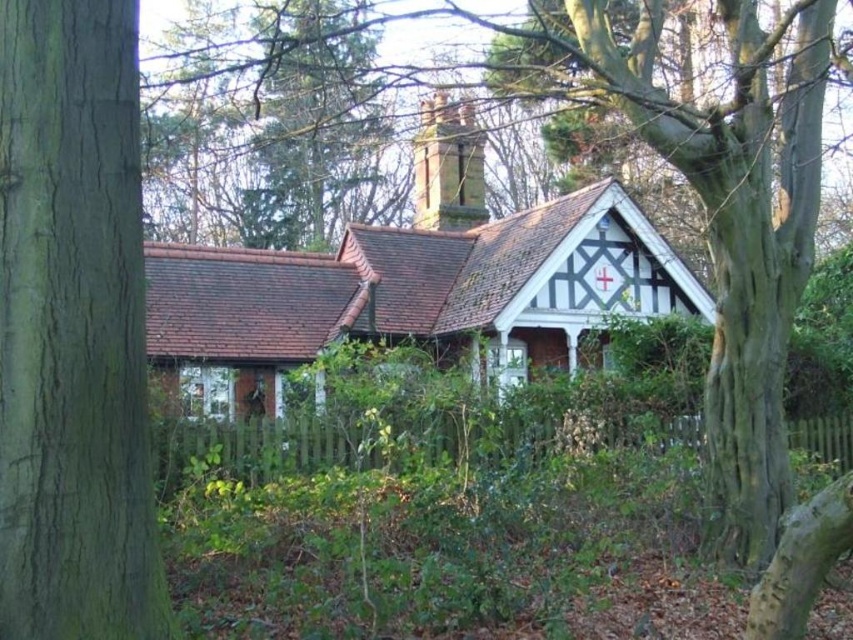
Question: Is green rough bark tree at left thinner than white painted wood cottage at center?

Choices:
 (A) yes
 (B) no

Answer: (A)

Question: Which point is farther to the camera?

Choices:
 (A) (389, 269)
 (B) (125, 340)

Answer: (A)

Question: Which point is farther to the camera?

Choices:
 (A) white painted wood cottage at center
 (B) green rough bark tree at left

Answer: (A)

Question: Does green rough bark tree at left appear under white painted wood cottage at center?

Choices:
 (A) no
 (B) yes

Answer: (B)

Question: Can you confirm if green rough bark tree at left is thinner than white painted wood cottage at center?

Choices:
 (A) yes
 (B) no

Answer: (A)